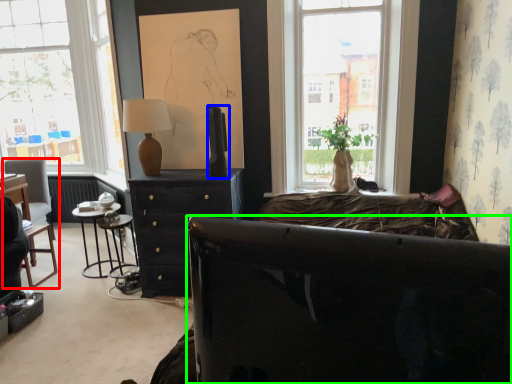
Question: Which object is positioned farthest from chair (highlighted by a red box)? Select from television (highlighted by a blue box) and studio couch (highlighted by a green box).

Choices:
 (A) television
 (B) studio couch

Answer: (B)